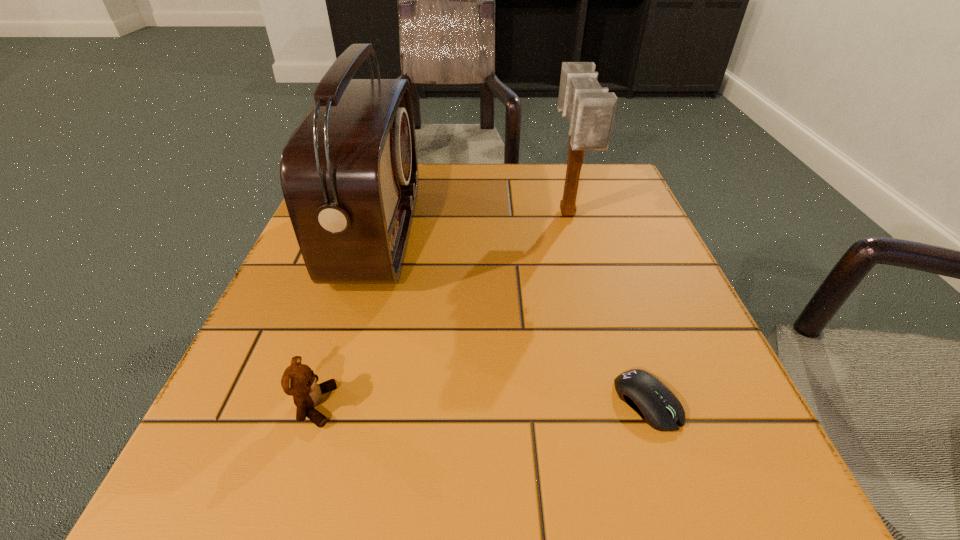
Where is `free space at the near left corner of the desktop`? This screenshot has width=960, height=540. free space at the near left corner of the desktop is located at coordinates coord(225,465).

The height and width of the screenshot is (540, 960). I want to click on vacant space at the far right corner, so click(607, 174).

You are a GUI agent. You are given a task and a screenshot of the screen. Output one action in this format:
    pyautogui.click(x=<x>, y=<y>)
    Task: Click on the unoccupied area between the third tallest object and the computer equipment
    The image size is (960, 540).
    Given the screenshot: What is the action you would take?
    pyautogui.click(x=481, y=404)

This screenshot has width=960, height=540. Identify the location of free space between the second tallest object and the shortest object. (608, 308).

The height and width of the screenshot is (540, 960). I want to click on empty space between the third shortest object and the computer equipment, so (608, 308).

Where is `vacant area that lies between the mallet and the shortest object`? vacant area that lies between the mallet and the shortest object is located at coordinates (608, 308).

This screenshot has width=960, height=540. I want to click on vacant area that lies between the shortest object and the mallet, so click(x=608, y=308).

I want to click on vacant area between the teddy bear and the second tallest object, so click(x=441, y=310).

In order to click on free space between the mallet and the third tallest object in this screenshot , I will do `click(441, 310)`.

Identify the location of unoccupied position between the shortest object and the radio receiver. (513, 318).